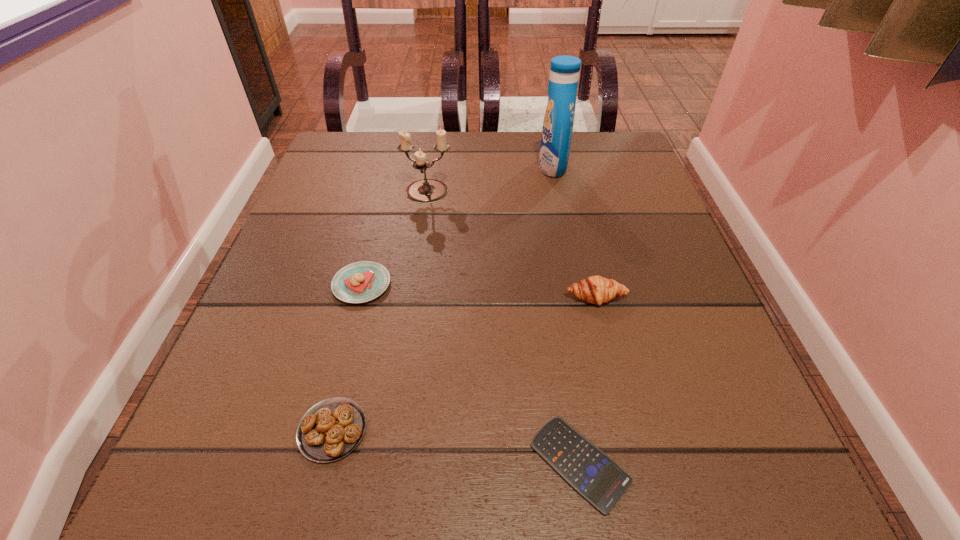
The height and width of the screenshot is (540, 960). What are the coordinates of `free space located 0.340m on the front-facing side of the detergent` in the screenshot? It's located at (396, 167).

Image resolution: width=960 pixels, height=540 pixels. I want to click on vacant space situated on the right of the candle holder, so click(583, 193).

Locate an element on the screen. This screenshot has width=960, height=540. free space located 0.250m on the front-facing side of the rightmost pastry is located at coordinates (635, 456).

I want to click on vacant point located 0.140m on the front of the second tallest pastry, so click(x=338, y=379).

Where is `vacant space located on the right of the shortest pastry`? This screenshot has width=960, height=540. vacant space located on the right of the shortest pastry is located at coordinates (521, 430).

Identify the location of vacant space located on the left of the shortest object. The width and height of the screenshot is (960, 540). (469, 463).

Find the location of a particular element. This screenshot has height=540, width=960. detergent located in the far edge section of the desktop is located at coordinates (558, 121).

At what (x,y) coordinates should I click in order to perform the action: click on candle holder at the far edge. Please return your answer as a coordinate pair (x, y). The width and height of the screenshot is (960, 540). Looking at the image, I should click on (424, 191).

Find the location of a particular element. This screenshot has height=540, width=960. pastry at the near edge is located at coordinates (331, 429).

The height and width of the screenshot is (540, 960). In order to click on calculator that is at the near edge in this screenshot , I will do `click(595, 476)`.